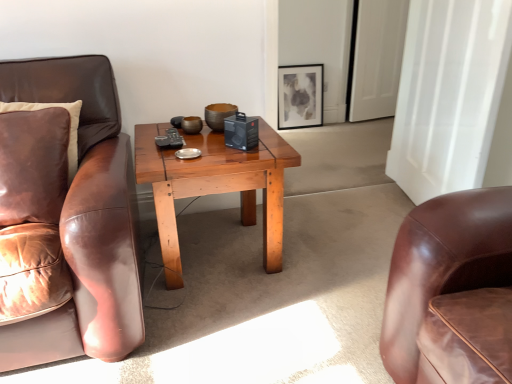
Identify the location of free space above wooden coffee table at center (from a real-world perspective). (191, 146).